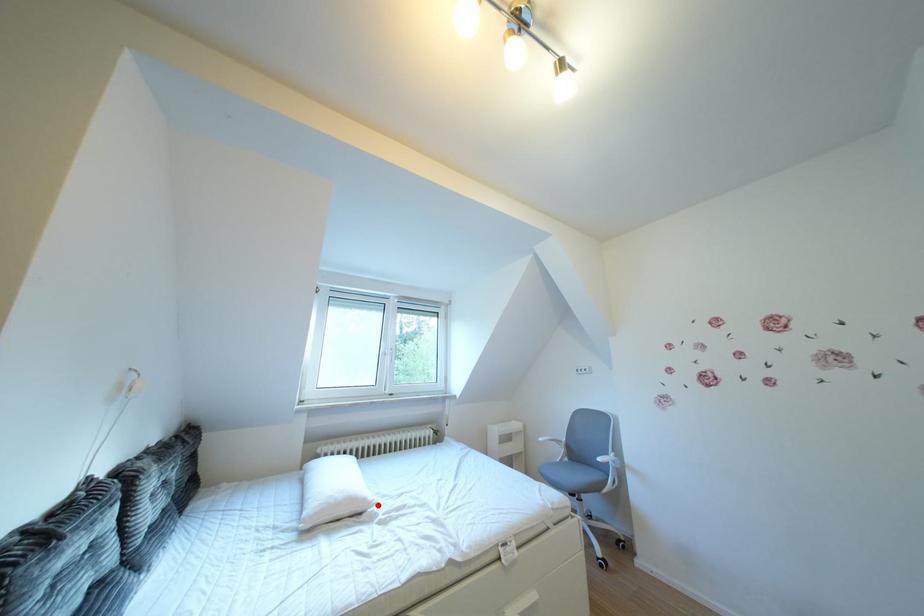
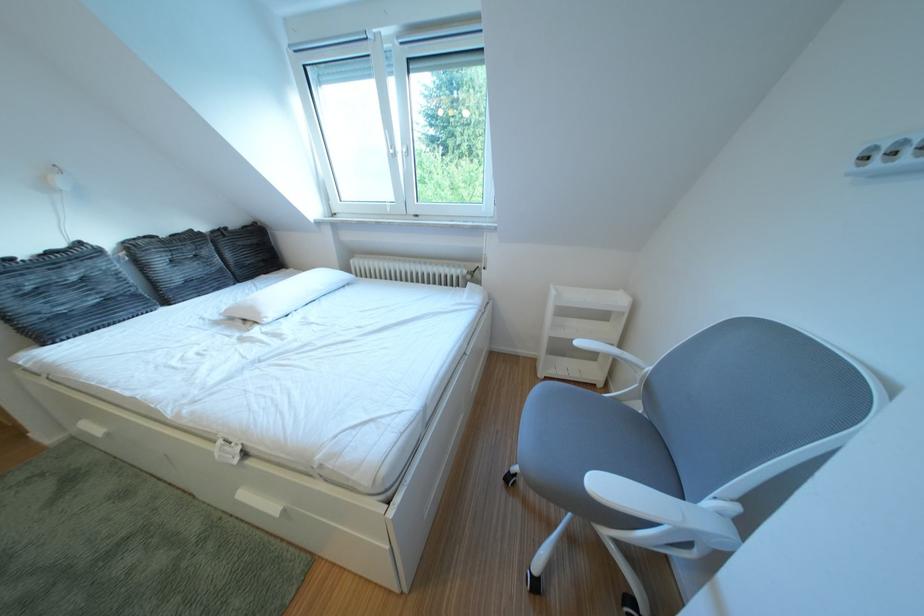
In the second image, find the point that corresponds to the highlighted location in the first image.

(273, 318)